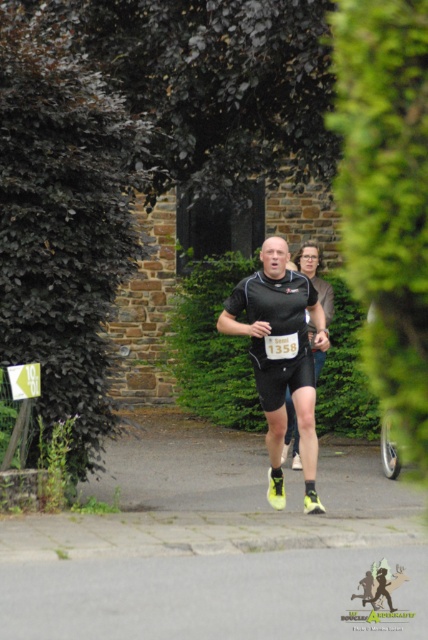
Can you confirm if dark green leafy hedge at left is shorter than matte black running suit at center?

No.

Describe the element at coordinates (62, 221) in the screenshot. I see `dark green leafy hedge at left` at that location.

The height and width of the screenshot is (640, 428). What are the coordinates of `dark green leafy hedge at left` in the screenshot? It's located at (62, 221).

Is the position of green leafy hedge at center less distant than that of matte black running suit at center?

No, it is behind matte black running suit at center.

Is point (338, 420) less distant than point (285, 412)?

No, (338, 420) is behind (285, 412).

Where is `green leafy hedge at center`? The width and height of the screenshot is (428, 640). green leafy hedge at center is located at coordinates (211, 346).

Measure the distance between dark green leafy hedge at left and green leafy hedge at center.

dark green leafy hedge at left is 5.24 meters away from green leafy hedge at center.

Is dark green leafy hedge at left below green leafy hedge at center?

No.

Between point (61, 157) and point (344, 381), which one is positioned in front?

Point (61, 157) is in front.

Locate an element on the screen. The height and width of the screenshot is (640, 428). dark green leafy hedge at left is located at coordinates (62, 221).